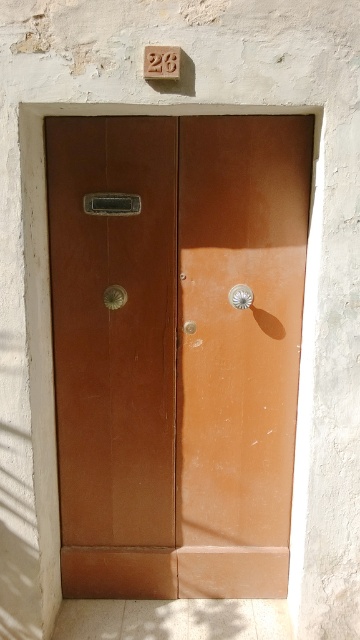
Who is more distant from viewer, (x=101, y=516) or (x=240, y=304)?

Positioned behind is point (x=101, y=516).

Does point (272, 497) lie behind point (228, 296)?

Yes, point (272, 497) is behind point (228, 296).

Who is more forward, (159,524) or (244,289)?

Point (244,289) is more forward.

The height and width of the screenshot is (640, 360). I want to click on matte brown door at center, so click(177, 352).

Can you confirm if matte brown door at center is thinner than matte metallic door handle at center?

No.

Can you confirm if matte brown door at center is wider than matte metallic door handle at center?

Yes.

Is point (136, 464) closer to viewer compared to point (108, 292)?

No, it is not.

Locate an element on the screen. The height and width of the screenshot is (640, 360). matte brown door at center is located at coordinates (177, 352).

Does matte brass door handle at center have a smaller size compared to polished brass knob at center?

Incorrect, matte brass door handle at center is not smaller in size than polished brass knob at center.

Who is more forward, (95, 193) or (182, 328)?

Positioned in front is point (95, 193).

This screenshot has height=640, width=360. I want to click on matte brass door handle at center, so click(x=111, y=204).